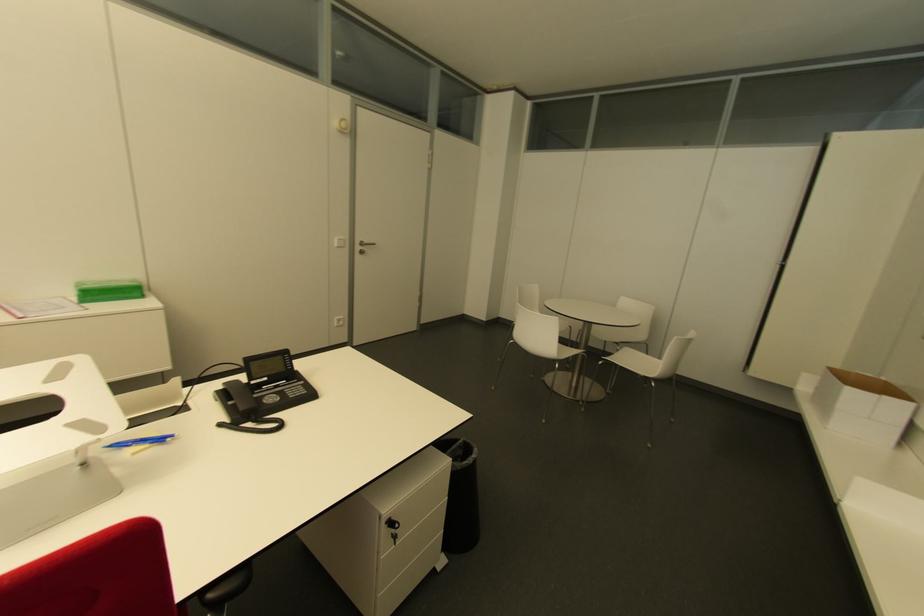
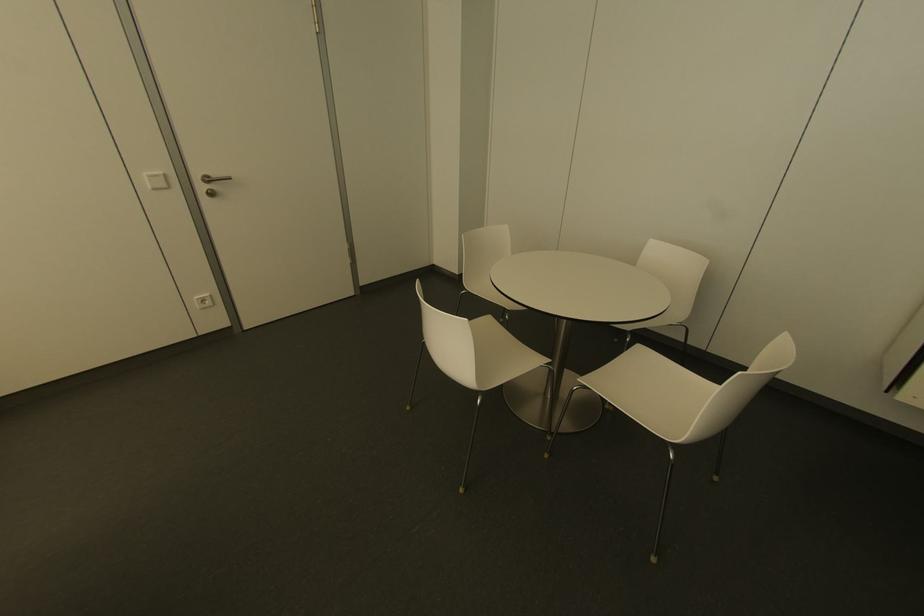
Locate, in the second image, the point that corresponds to pixel 363 241 in the first image.

(213, 175)